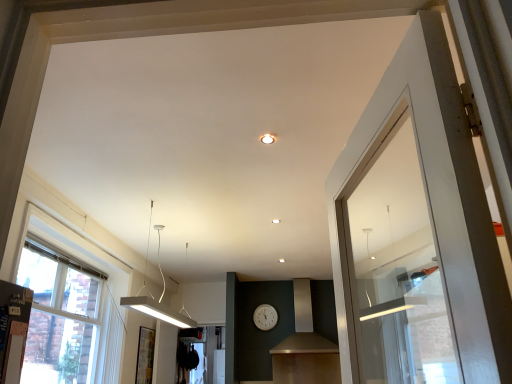
Question: Can you confirm if white wood window at left is bigger than matte white ceiling light at center?

Choices:
 (A) yes
 (B) no

Answer: (A)

Question: From a real-world perspective, is white wood window at left on matte white ceiling light at center?

Choices:
 (A) yes
 (B) no

Answer: (B)

Question: Considering the relative sizes of white wood window at left and matte white ceiling light at center in the image provided, is white wood window at left smaller than matte white ceiling light at center?

Choices:
 (A) yes
 (B) no

Answer: (B)

Question: Does white wood window at left turn towards matte white ceiling light at center?

Choices:
 (A) no
 (B) yes

Answer: (B)

Question: Is white wood window at left to the left of matte white ceiling light at center from the viewer's perspective?

Choices:
 (A) no
 (B) yes

Answer: (B)

Question: From a real-world perspective, is white plastic clock at center above or below white wood window at left?

Choices:
 (A) above
 (B) below

Answer: (A)

Question: From the image's perspective, is white plastic clock at center positioned above or below white wood window at left?

Choices:
 (A) below
 (B) above

Answer: (A)

Question: Is white plastic clock at center situated inside white wood window at left or outside?

Choices:
 (A) inside
 (B) outside

Answer: (B)

Question: Considering the relative positions of white plastic clock at center and white wood window at left in the image provided, is white plastic clock at center to the left or to the right of white wood window at left?

Choices:
 (A) right
 (B) left

Answer: (A)

Question: Considering the positions of point (272, 142) and point (158, 266), is point (272, 142) closer or farther from the camera than point (158, 266)?

Choices:
 (A) farther
 (B) closer

Answer: (B)

Question: From their relative heights in the image, would you say matte white ceiling light at center is taller or shorter than white matte rectangular light fixture at left?

Choices:
 (A) short
 (B) tall

Answer: (A)

Question: From a real-world perspective, is matte white ceiling light at center above or below white matte rectangular light fixture at left?

Choices:
 (A) below
 (B) above

Answer: (B)

Question: Choose the correct answer: Is matte white ceiling light at center inside white matte rectangular light fixture at left or outside it?

Choices:
 (A) outside
 (B) inside

Answer: (A)

Question: In terms of height, does matte black vent at center look taller or shorter compared to white plastic clock at center?

Choices:
 (A) tall
 (B) short

Answer: (A)

Question: Is point (330, 317) closer or farther from the camera than point (276, 314)?

Choices:
 (A) closer
 (B) farther

Answer: (B)